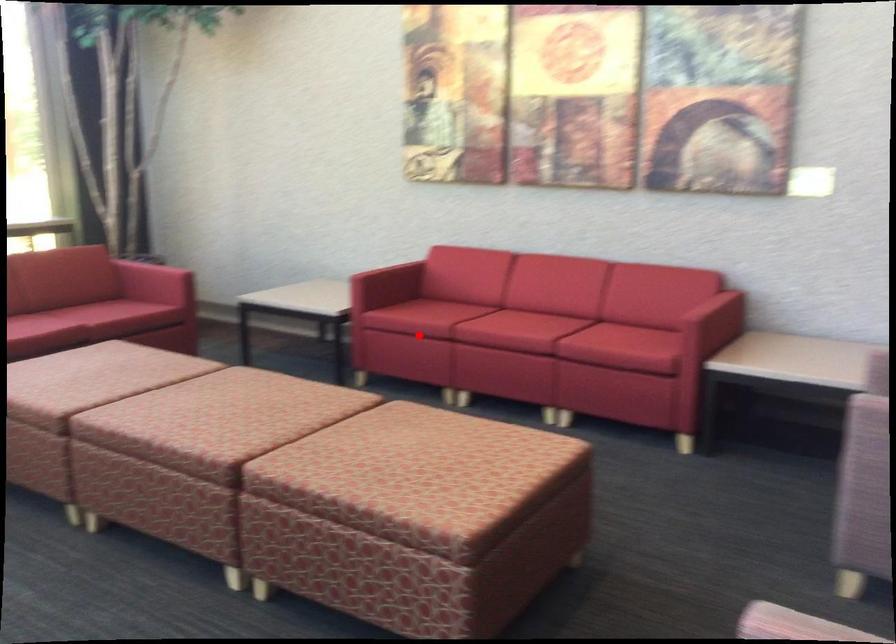
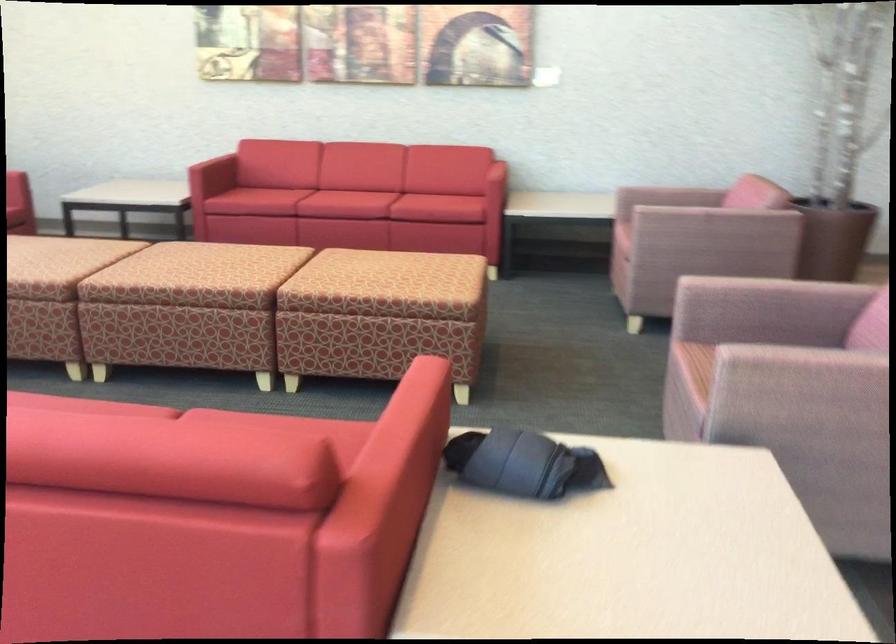
In the second image, find the point that corresponds to the highlighted location in the first image.

(265, 200)